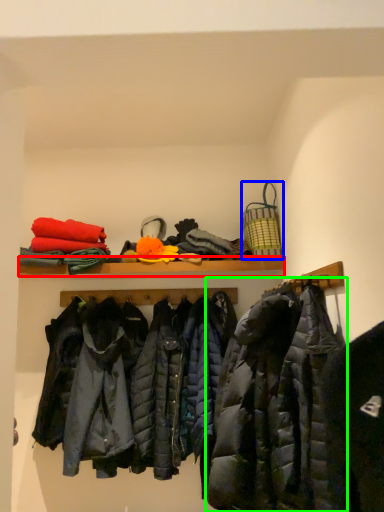
Question: Considering the real-world distances, which object is closest to shelf (highlighted by a red box)? basket (highlighted by a blue box) or jacket (highlighted by a green box).

Choices:
 (A) basket
 (B) jacket

Answer: (A)